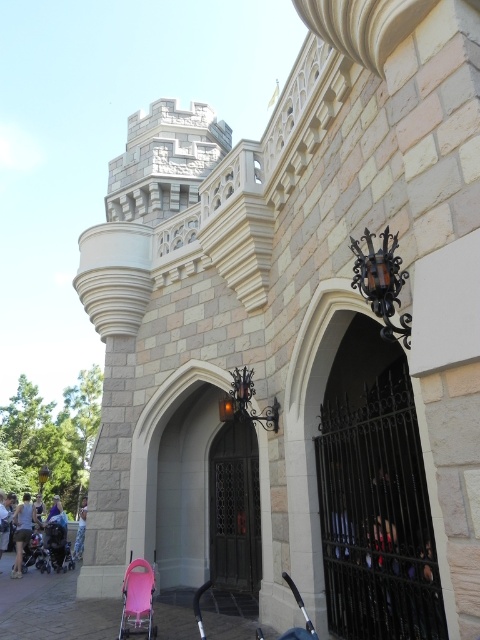
You are a parent with a child in the matte black stroller at lower left. You want to push the stroller through the wooden gate at center. Can you do this easily?

The wooden gate at center is positioned over matte black stroller at lower left, meaning the gate is above the stroller. Since the stroller is underneath the gate, you can easily push it through as the gate does not block the path.